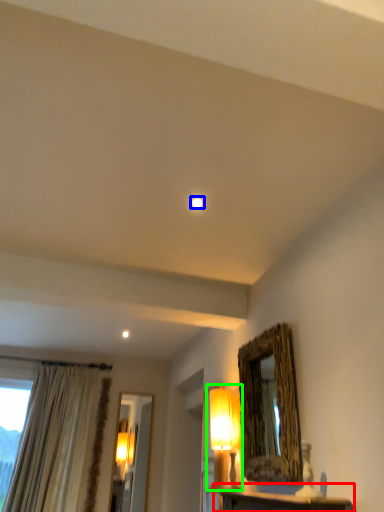
Question: Considering the real-world distances, which object is closest to table (highlighted by a red box)? lighting (highlighted by a blue box) or table lamp (highlighted by a green box).

Choices:
 (A) lighting
 (B) table lamp

Answer: (B)